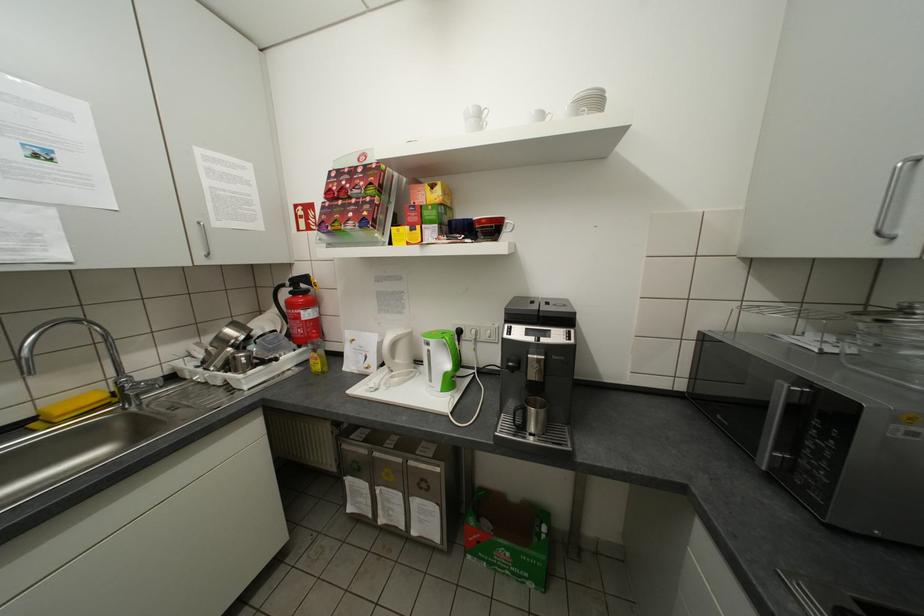
What do you see at coordinates (453, 350) in the screenshot? I see `the green kettle handle` at bounding box center [453, 350].